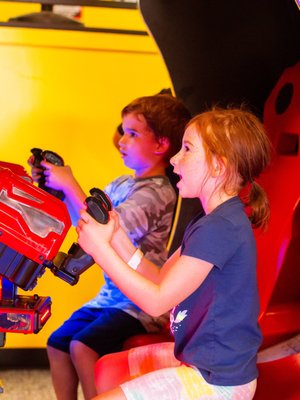
Image resolution: width=300 pixels, height=400 pixels. Find the location of `floor`. floor is located at coordinates (39, 383).